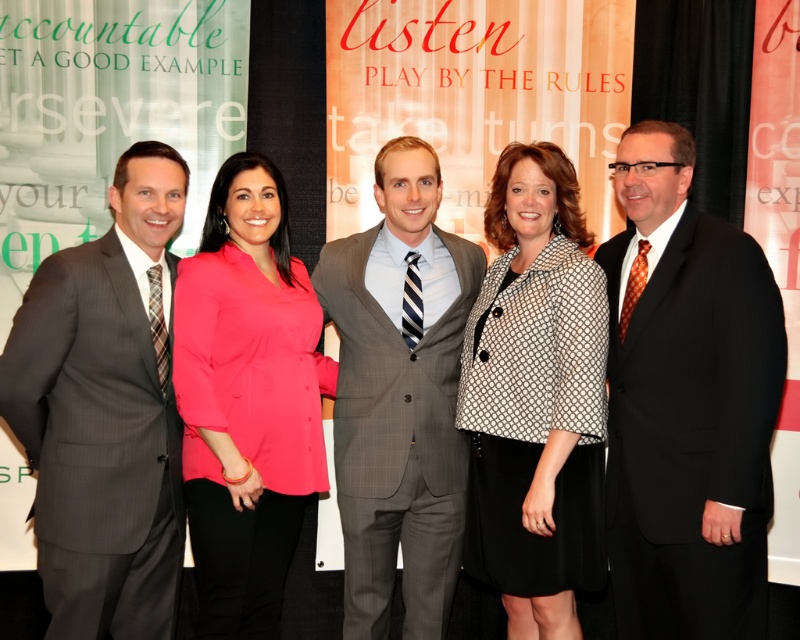
Question: Is black pinstripe suit at right bigger than gray pinstripe suit at center?

Choices:
 (A) no
 (B) yes

Answer: (B)

Question: Which of the following is the farthest from the observer?

Choices:
 (A) gray pinstripe suit at left
 (B) gray pinstripe suit at center

Answer: (B)

Question: Which object appears closest to the camera in this image?

Choices:
 (A) black textured blazer at center
 (B) gray pinstripe suit at center
 (C) pink satin blouse at center

Answer: (A)

Question: Which object is positioned closest to the gray pinstripe suit at center?

Choices:
 (A) pink satin blouse at center
 (B) gray pinstripe suit at left
 (C) black textured blazer at center
 (D) black pinstripe suit at right

Answer: (C)

Question: Does black textured blazer at center lie in front of gray pinstripe suit at center?

Choices:
 (A) no
 (B) yes

Answer: (B)

Question: In this image, where is black pinstripe suit at right located relative to gray pinstripe suit at center?

Choices:
 (A) below
 (B) above

Answer: (B)